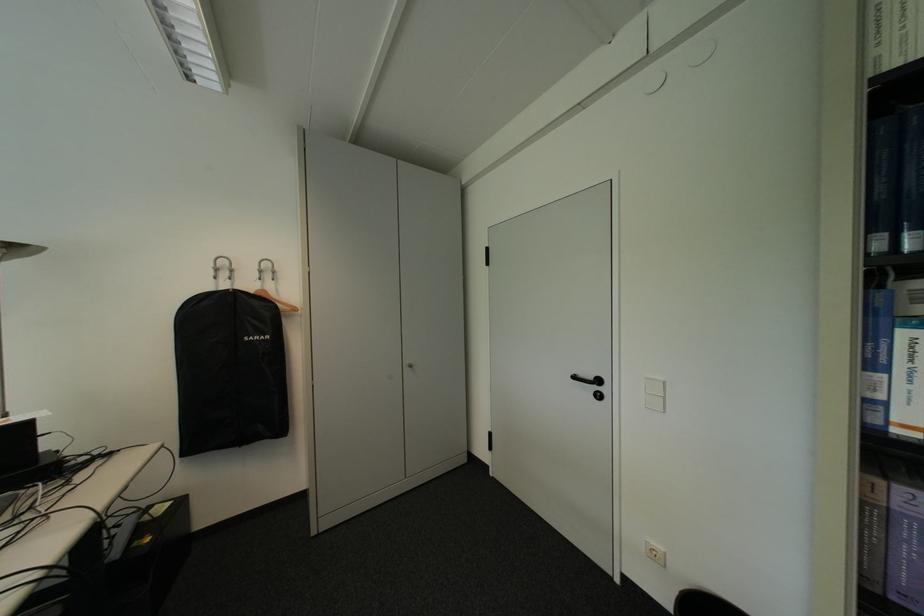
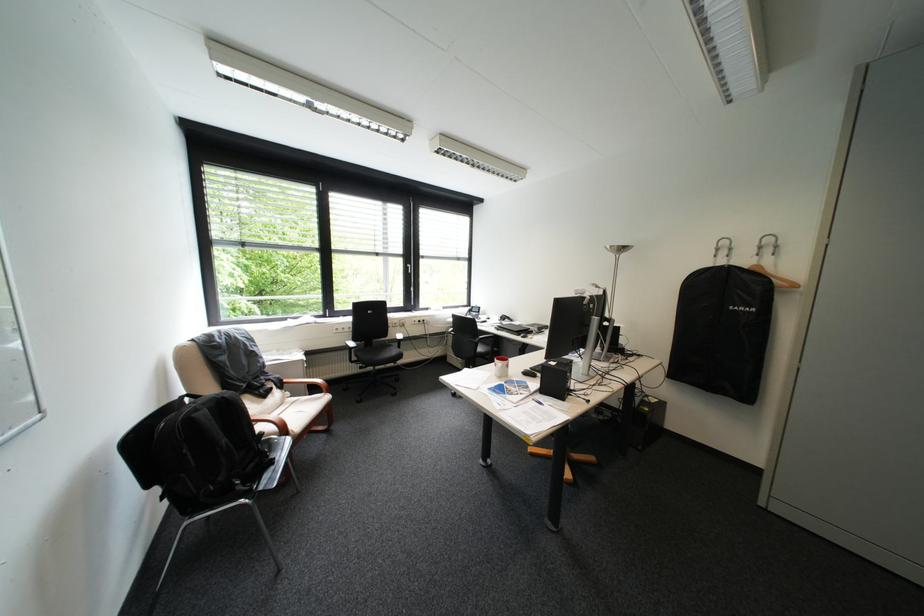
In the second image, find the point that corresponds to point 224,265 in the first image.

(727, 246)